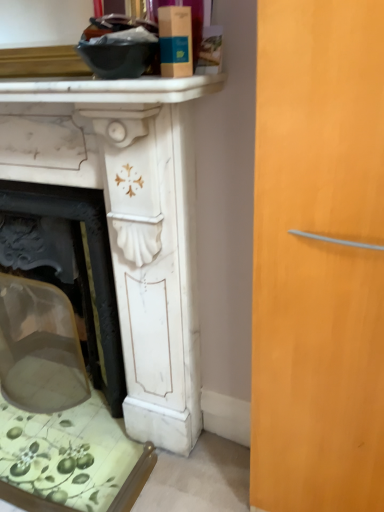
Question: Considering the relative positions of white marble fireplace mantel at upper center and white marble fireplace at left in the image provided, is white marble fireplace mantel at upper center behind white marble fireplace at left?

Choices:
 (A) no
 (B) yes

Answer: (A)

Question: Considering the relative sizes of white marble fireplace mantel at upper center and white marble fireplace at left in the image provided, is white marble fireplace mantel at upper center shorter than white marble fireplace at left?

Choices:
 (A) no
 (B) yes

Answer: (B)

Question: From the image's perspective, is white marble fireplace mantel at upper center on white marble fireplace at left?

Choices:
 (A) yes
 (B) no

Answer: (A)

Question: Is white marble fireplace mantel at upper center to the right of white marble fireplace at left from the viewer's perspective?

Choices:
 (A) no
 (B) yes

Answer: (B)

Question: Is white marble fireplace mantel at upper center with white marble fireplace at left?

Choices:
 (A) no
 (B) yes

Answer: (A)

Question: Can you confirm if white marble fireplace mantel at upper center is wider than white marble fireplace at left?

Choices:
 (A) no
 (B) yes

Answer: (A)

Question: From the image's perspective, does white marble fireplace at left appear lower than white marble fireplace mantel at upper center?

Choices:
 (A) yes
 (B) no

Answer: (A)

Question: Can you confirm if white marble fireplace at left is wider than white marble fireplace mantel at upper center?

Choices:
 (A) yes
 (B) no

Answer: (A)

Question: From a real-world perspective, is white marble fireplace at left located beneath white marble fireplace mantel at upper center?

Choices:
 (A) yes
 (B) no

Answer: (A)

Question: Is white marble fireplace at left further to camera compared to white marble fireplace mantel at upper center?

Choices:
 (A) no
 (B) yes

Answer: (B)

Question: Considering the relative positions of white marble fireplace at left and white marble fireplace mantel at upper center in the image provided, is white marble fireplace at left to the left of white marble fireplace mantel at upper center from the viewer's perspective?

Choices:
 (A) no
 (B) yes

Answer: (B)

Question: From a real-world perspective, is white marble fireplace at left on white marble fireplace mantel at upper center?

Choices:
 (A) yes
 (B) no

Answer: (B)

Question: From their relative heights in the image, would you say white marble fireplace at left is taller or shorter than white marble fireplace mantel at upper center?

Choices:
 (A) short
 (B) tall

Answer: (B)